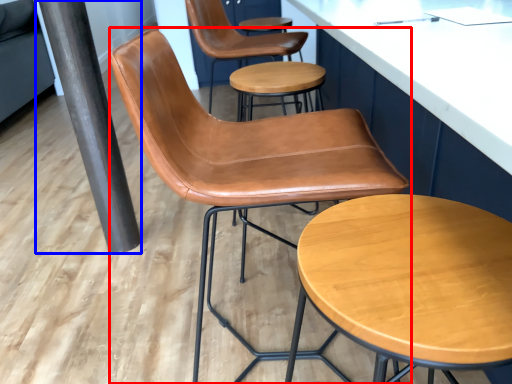
Question: Which object appears closest to the camera in this image, chair (highlighted by a red box) or beam (highlighted by a blue box)?

Choices:
 (A) chair
 (B) beam

Answer: (A)